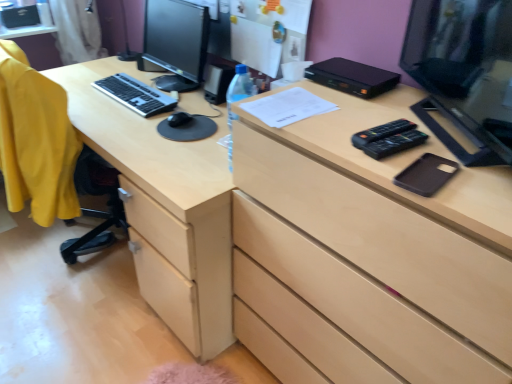
Where is `light wood desk at center`? This screenshot has width=512, height=384. light wood desk at center is located at coordinates (165, 207).

What do you see at coordinates (175, 42) in the screenshot? The width and height of the screenshot is (512, 384). I see `matte black monitor at center left, the 1th computer monitor from the left` at bounding box center [175, 42].

Locate an element on the screen. The height and width of the screenshot is (384, 512). black plastic printer at upper center is located at coordinates (352, 77).

In order to face yellow fabric computer chair at left, should I rotate leftwards or rightwards?

To face it directly, rotate left by 29.300 degrees.

The height and width of the screenshot is (384, 512). Describe the element at coordinates (287, 107) in the screenshot. I see `white paper at center` at that location.

At what (x,y) coordinates should I click in order to perform the action: click on black matte mouse at center. Please return your answer as a coordinate pair (x, y). Image resolution: width=512 pixels, height=384 pixels. Looking at the image, I should click on (179, 119).

Describe the element at coordinates (135, 95) in the screenshot. Image resolution: width=512 pixels, height=384 pixels. I see `silver metallic keyboard at center-left` at that location.

The height and width of the screenshot is (384, 512). In order to click on light wood desk at center in this screenshot , I will do `click(165, 207)`.

Is black matte mouse at center placed right next to yellow fabric computer chair at left?

They are not placed beside each other.

Which object is further away from the camera taking this photo, black matte mouse at center or yellow fabric computer chair at left?

black matte mouse at center is further from the camera.

In terms of width, does black matte mouse at center look wider or thinner when compared to yellow fabric computer chair at left?

black matte mouse at center is thinner than yellow fabric computer chair at left.

Identify the location of computer chair lying in front of the black matte mouse at center. This screenshot has width=512, height=384. (46, 151).

Are black plastic printer at upper center and matte black monitor at center left, marked as the second computer monitor in a right-to-left arrangement, far apart?

No, black plastic printer at upper center is in close proximity to matte black monitor at center left, marked as the second computer monitor in a right-to-left arrangement.

From the image's perspective, is black plastic printer at upper center on top of matte black monitor at center left, the 1th computer monitor from the left?

No, from the image's perspective, black plastic printer at upper center is not on top of matte black monitor at center left, the 1th computer monitor from the left.

Consider the image. From a real-world perspective, who is located lower, black plastic printer at upper center or matte black monitor at center left, marked as the second computer monitor in a front-to-back arrangement?

From a 3D spatial view, matte black monitor at center left, marked as the second computer monitor in a front-to-back arrangement, is below.

Is black plastic printer at upper center smaller than matte black monitor at center left, the 1th computer monitor from the left?

Yes.

Are matte black monitor at center left, the 1th computer monitor from the left, and black matte phone case at right making contact?

No, matte black monitor at center left, the 1th computer monitor from the left, is not next to black matte phone case at right.

Between matte black monitor at center left, marked as the second computer monitor in a right-to-left arrangement, and black matte phone case at right, which one has smaller size?

With smaller size is black matte phone case at right.

Visually, is matte black monitor at center left, marked as the second computer monitor in a front-to-back arrangement, positioned to the left or to the right of black matte phone case at right?

Based on their positions, matte black monitor at center left, marked as the second computer monitor in a front-to-back arrangement, is located to the left of black matte phone case at right.

From the image's perspective, is black glossy monitor at upper right, which ranks as the 1th computer monitor in right-to-left order, above light wood desk at center?

Indeed, from the image's perspective, black glossy monitor at upper right, which ranks as the 1th computer monitor in right-to-left order, is shown above light wood desk at center.

From a real-world perspective, who is located higher, black glossy monitor at upper right, the first computer monitor from the front, or light wood desk at center?

In real-world perspective, black glossy monitor at upper right, the first computer monitor from the front, is above.

Can you confirm if matte black monitor at center left, marked as the second computer monitor in a front-to-back arrangement, is thinner than yellow fabric computer chair at left?

Indeed, matte black monitor at center left, marked as the second computer monitor in a front-to-back arrangement, has a lesser width compared to yellow fabric computer chair at left.

Would you say matte black monitor at center left, the 1th computer monitor from the left, contains yellow fabric computer chair at left?

No, yellow fabric computer chair at left is not surrounded by matte black monitor at center left, the 1th computer monitor from the left.

In the scene shown: In terms of size, does matte black monitor at center left, marked as the second computer monitor in a right-to-left arrangement, appear bigger or smaller than yellow fabric computer chair at left?

In the image, matte black monitor at center left, marked as the second computer monitor in a right-to-left arrangement, appears to be smaller than yellow fabric computer chair at left.

How many degrees apart are the facing directions of white paper at center and black glossy monitor at upper right, the second computer monitor positioned from the back?

The angle between the facing direction of white paper at center and the facing direction of black glossy monitor at upper right, the second computer monitor positioned from the back, is 35.8 degrees.

The width and height of the screenshot is (512, 384). I want to click on computer monitor on the right of the white paper at center, so click(464, 74).

From a real-world perspective, is white paper at center positioned over black glossy monitor at upper right, the second computer monitor positioned from the back, based on gravity?

No.

Can you confirm if white paper at center is bigger than black glossy monitor at upper right, the second computer monitor positioned from the back?

Incorrect, white paper at center is not larger than black glossy monitor at upper right, the second computer monitor positioned from the back.

Find the location of a particular element. computer monitor above the white paper at center (from a real-world perspective) is located at coordinates (464, 74).

From the image's perspective, is black glossy monitor at upper right, which ranks as the 1th computer monitor in right-to-left order, above white paper at center?

Yes, from the image's perspective, black glossy monitor at upper right, which ranks as the 1th computer monitor in right-to-left order, is over white paper at center.

Which of these two, black glossy monitor at upper right, the first computer monitor from the front, or white paper at center, stands shorter?

With less height is white paper at center.

Is black glossy monitor at upper right, the first computer monitor from the front, not within white paper at center?

Absolutely, black glossy monitor at upper right, the first computer monitor from the front, is external to white paper at center.

Identify the location of computer chair in front of the black matte mouse at center. The image size is (512, 384). (46, 151).

At what (x,y) coordinates should I click in order to perform the action: click on printer below the matte black monitor at center left, marked as the second computer monitor in a right-to-left arrangement (from the image's perspective). Please return your answer as a coordinate pair (x, y). The image size is (512, 384). Looking at the image, I should click on (352, 77).

Which object lies nearer to the anchor point black matte phone case at right, yellow fabric computer chair at left or black matte mouse at center?

black matte mouse at center is closer to black matte phone case at right.

Based on their spatial positions, is black plastic printer at upper center or black matte mouse at center further from black glossy monitor at upper right, the second computer monitor positioned from the back?

black matte mouse at center lies further to black glossy monitor at upper right, the second computer monitor positioned from the back, than the other object.

Estimate the real-world distances between objects in this image. Which object is closer to white paper at center, matte black monitor at center left, marked as the second computer monitor in a front-to-back arrangement, or black matte mouse at center?

Based on the image, black matte mouse at center appears to be nearer to white paper at center.

From the image, which object appears to be farther from black glossy monitor at upper right, which is counted as the 2th computer monitor, starting from the left, light wood desk at center or black plastic printer at upper center?

light wood desk at center.

From the image, which object appears to be farther from matte black monitor at center left, marked as the second computer monitor in a front-to-back arrangement, light wood desk at center or black matte mouse at center?

Based on the image, black matte mouse at center appears to be further to matte black monitor at center left, marked as the second computer monitor in a front-to-back arrangement.

Based on their spatial positions, is black plastic printer at upper center or black glossy monitor at upper right, which is counted as the 2th computer monitor, starting from the left, further from black matte phone case at right?

The object further to black matte phone case at right is black plastic printer at upper center.

Which object lies nearer to the anchor point yellow fabric computer chair at left, black glossy monitor at upper right, which is counted as the 2th computer monitor, starting from the left, or light wood desk at center?

Based on the image, light wood desk at center appears to be nearer to yellow fabric computer chair at left.

Which object lies further to the anchor point light wood desk at center, yellow fabric computer chair at left or white paper at center?

Among the two, white paper at center is located further to light wood desk at center.

The image size is (512, 384). Identify the location of mouse between black glossy monitor at upper right, the first computer monitor from the front, and silver metallic keyboard at center-left, along the z-axis. (179, 119).

Where is `printer situated between yellow fabric computer chair at left and black glossy monitor at upper right, which ranks as the 1th computer monitor in right-to-left order, from left to right`? This screenshot has width=512, height=384. printer situated between yellow fabric computer chair at left and black glossy monitor at upper right, which ranks as the 1th computer monitor in right-to-left order, from left to right is located at coordinates (352, 77).

At what (x,y) coordinates should I click in order to perform the action: click on computer keyboard between matte black monitor at center left, the 1th computer monitor from the left, and black matte mouse at center, in the vertical direction. Please return your answer as a coordinate pair (x, y). The height and width of the screenshot is (384, 512). Looking at the image, I should click on (135, 95).

Identify the location of printer between black glossy monitor at upper right, which ranks as the 1th computer monitor in right-to-left order, and silver metallic keyboard at center-left from front to back. (352, 77).